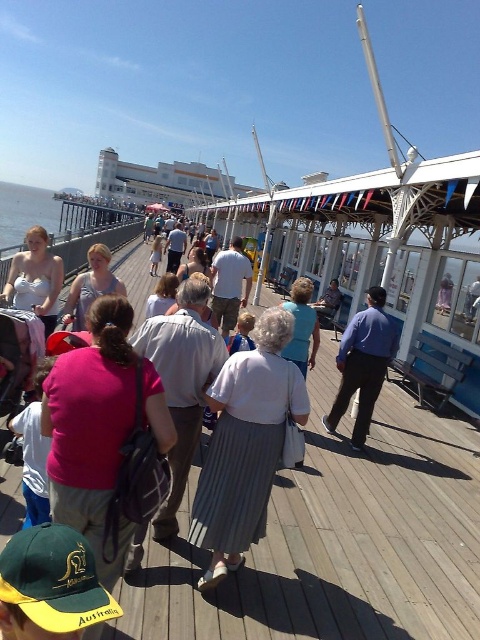
Is point (307, 604) farther from camera compared to point (26, 198)?

No, it is not.

Can you confirm if wooden dock at center is wider than clear blue water at pier left?

No.

You are a GUI agent. You are given a task and a screenshot of the screen. Output one action in this format:
    pyautogui.click(x=<x>, y=<y>)
    Task: Click on the wooden dock at center
    
    Given the screenshot: What is the action you would take?
    pyautogui.click(x=336, y=540)

Can you confirm if matte white tank top at center is thinner than light blue fabric at center?

Incorrect, matte white tank top at center's width is not less than light blue fabric at center's.

Is point (49, 262) closer to viewer compared to point (444, 276)?

That is True.

Identify the location of matte white tank top at center. (36, 278).

Is pink fabric shirt at center wider than matte white shirt at center?

Indeed, pink fabric shirt at center has a greater width compared to matte white shirt at center.

In the scene shown: Is pink fabric shirt at center bigger than matte white shirt at center?

Yes, pink fabric shirt at center is bigger than matte white shirt at center.

Where is `pink fabric shirt at center`? Image resolution: width=480 pixels, height=640 pixels. pink fabric shirt at center is located at coordinates (107, 436).

Identify the location of pink fabric shirt at center. This screenshot has width=480, height=640. [x=107, y=436].